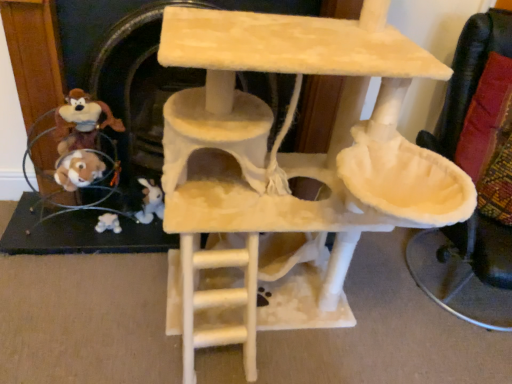
Question: Can you confirm if beige felt cat tree at center is wider than white plush toy at lower left, placed as the 2th toy when sorted from top to bottom?

Choices:
 (A) yes
 (B) no

Answer: (A)

Question: Can you confirm if beige felt cat tree at center is bigger than white plush toy at lower left, the 1th toy from the back?

Choices:
 (A) yes
 (B) no

Answer: (A)

Question: Would you say white plush toy at lower left, the first toy ordered from the bottom, is part of beige felt cat tree at center's contents?

Choices:
 (A) yes
 (B) no

Answer: (B)

Question: Considering the relative sizes of beige felt cat tree at center and white plush toy at lower left, placed as the 2th toy when sorted from top to bottom, in the image provided, is beige felt cat tree at center thinner than white plush toy at lower left, placed as the 2th toy when sorted from top to bottom,?

Choices:
 (A) yes
 (B) no

Answer: (B)

Question: Is white plush toy at lower left, the first toy ordered from the bottom, at the back of beige felt cat tree at center?

Choices:
 (A) yes
 (B) no

Answer: (B)

Question: Is beige felt cat tree at center taller than white plush toy at lower left, placed as the 2th toy when sorted from top to bottom?

Choices:
 (A) yes
 (B) no

Answer: (A)

Question: Is beige felt cat tree at center placed right next to brown plush toy at left, which ranks as the 2th toy in back-to-front order?

Choices:
 (A) yes
 (B) no

Answer: (B)

Question: Is beige felt cat tree at center located outside brown plush toy at left, which is the 1th toy in front-to-back order?

Choices:
 (A) yes
 (B) no

Answer: (A)

Question: From the image's perspective, is beige felt cat tree at center over brown plush toy at left, which ranks as the 2th toy in back-to-front order?

Choices:
 (A) yes
 (B) no

Answer: (B)

Question: Can you confirm if beige felt cat tree at center is taller than brown plush toy at left, which is the 1th toy in front-to-back order?

Choices:
 (A) yes
 (B) no

Answer: (A)

Question: From a real-world perspective, is beige felt cat tree at center physically above brown plush toy at left, which ranks as the 2th toy in back-to-front order?

Choices:
 (A) no
 (B) yes

Answer: (B)

Question: Is beige felt cat tree at center positioned with its back to brown plush toy at left, positioned as the 2th toy in bottom-to-top order?

Choices:
 (A) no
 (B) yes

Answer: (A)

Question: Considering the relative sizes of brown plush toy at left, which ranks as the 2th toy in back-to-front order, and beige felt cat tree at center in the image provided, is brown plush toy at left, which ranks as the 2th toy in back-to-front order, wider than beige felt cat tree at center?

Choices:
 (A) yes
 (B) no

Answer: (B)